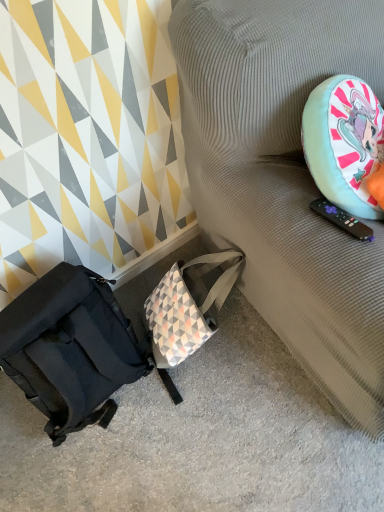
Question: From their relative heights in the image, would you say matte black backpack at lower left is taller or shorter than textured fabric couch at right?

Choices:
 (A) tall
 (B) short

Answer: (B)

Question: Relative to textured fabric couch at right, is matte black backpack at lower left in front or behind?

Choices:
 (A) front
 (B) behind

Answer: (B)

Question: From a real-world perspective, is matte black backpack at lower left above or below textured fabric couch at right?

Choices:
 (A) above
 (B) below

Answer: (B)

Question: From a real-world perspective, relative to matte black backpack at lower left, is textured fabric couch at right vertically above or below?

Choices:
 (A) above
 (B) below

Answer: (A)

Question: Is textured fabric couch at right taller or shorter than matte black backpack at lower left?

Choices:
 (A) tall
 (B) short

Answer: (A)

Question: Is textured fabric couch at right in front of or behind matte black backpack at lower left in the image?

Choices:
 (A) front
 (B) behind

Answer: (A)

Question: Is point (372, 1) positioned closer to the camera than point (69, 401)?

Choices:
 (A) farther
 (B) closer

Answer: (B)